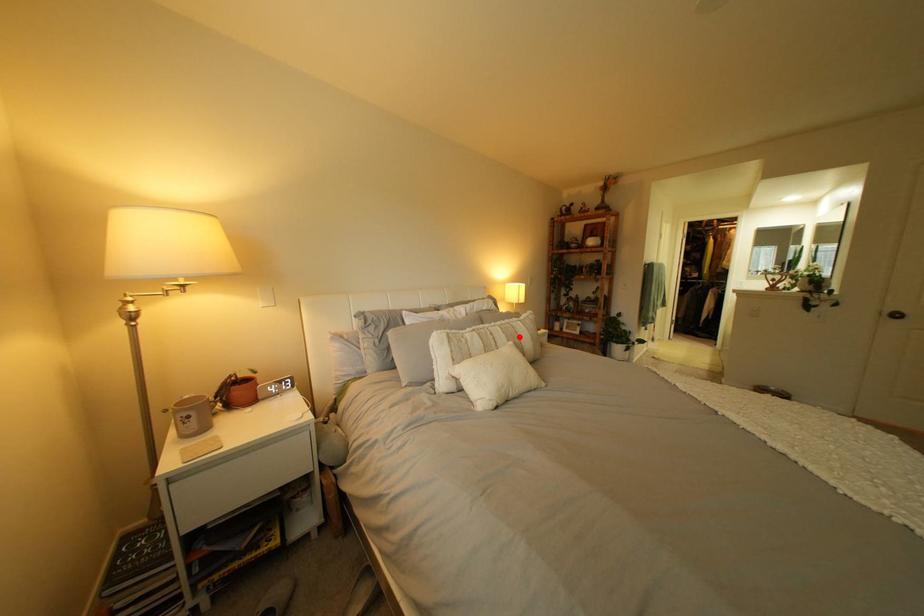
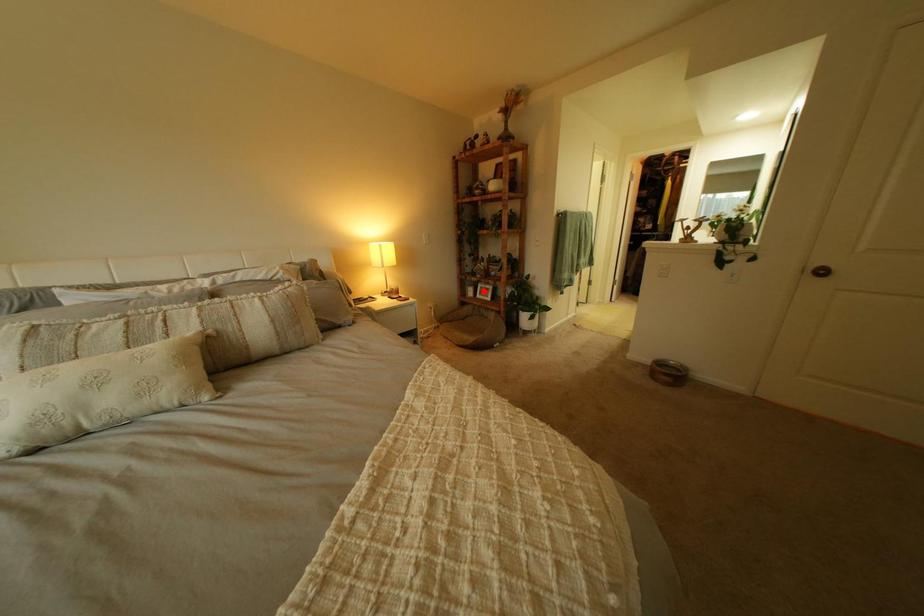
I am providing you with two images of the same scene from different viewpoints. A red point is marked on the first image and another point is marked on the second image. Is the red point in image1 aligned with the point shown in image2?

No